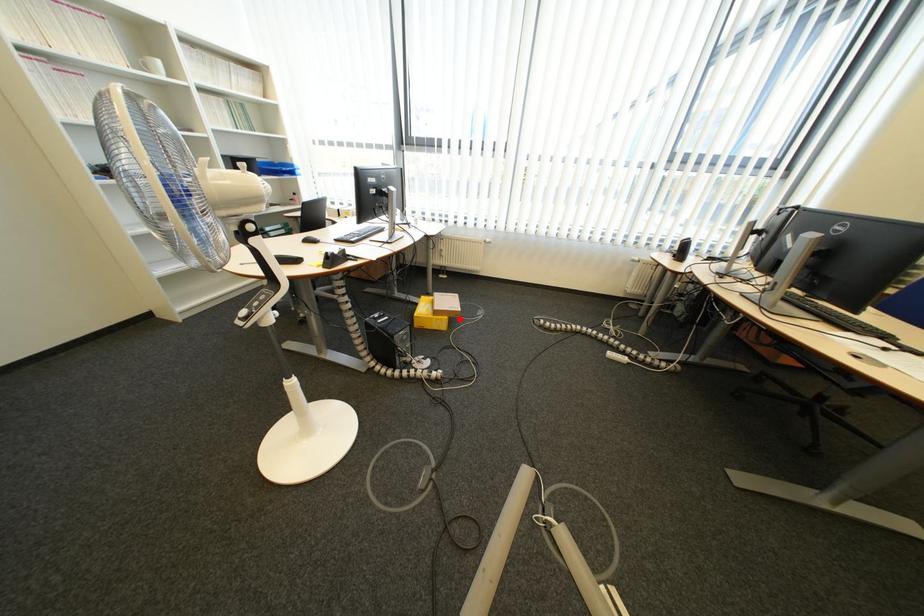
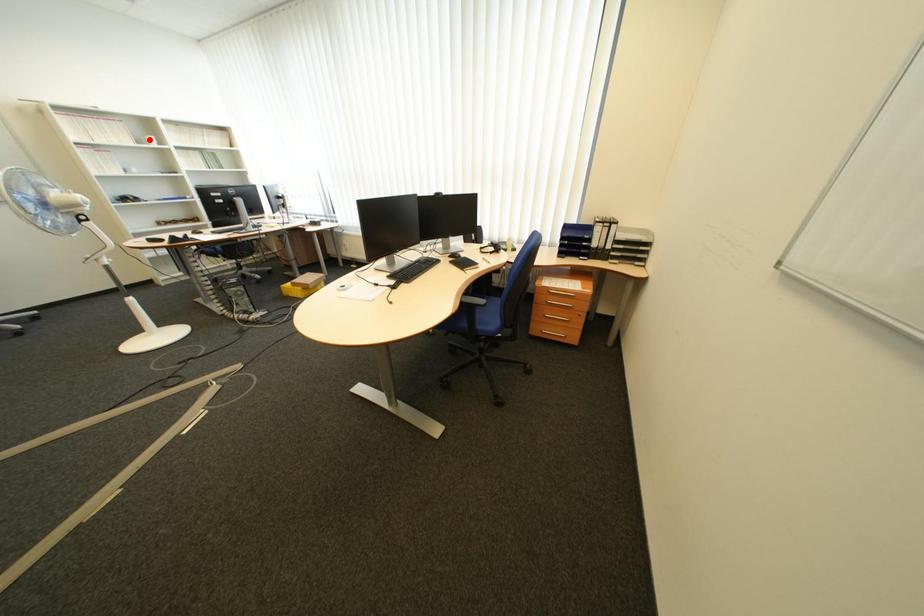
I am providing you with two images of the same scene from different viewpoints. A red point is marked on the first image and another point is marked on the second image. Do the highlighted points in image1 and image2 indicate the same real-world spot?

No